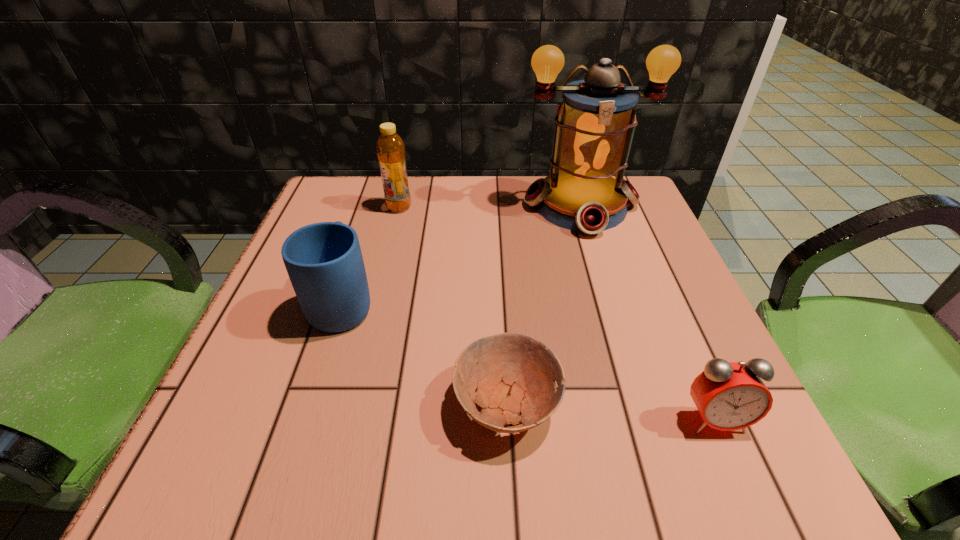
Where is `free space between the shortest object and the fourth shortest object`? free space between the shortest object and the fourth shortest object is located at coordinates (452, 306).

Where is `empty space between the lantern and the alarm clock`? This screenshot has width=960, height=540. empty space between the lantern and the alarm clock is located at coordinates (647, 312).

You are a GUI agent. You are given a task and a screenshot of the screen. Output one action in this format:
    pyautogui.click(x=<x>, y=<y>)
    Task: Click on the unoccupied position between the fourth tallest object and the lantern
    
    Given the screenshot: What is the action you would take?
    pyautogui.click(x=647, y=312)

Find the location of `vacant area that lies between the bowl and the bottle`. vacant area that lies between the bowl and the bottle is located at coordinates (452, 306).

Find the location of a particular element. This screenshot has width=960, height=540. free spot between the second tallest object and the alarm clock is located at coordinates point(557,313).

The height and width of the screenshot is (540, 960). Find the location of `free spot between the shortest object and the lantern`. free spot between the shortest object and the lantern is located at coordinates (543, 305).

Locate an element on the screen. the second closest object to the bowl is located at coordinates (729, 396).

Find the location of a particular element. Image resolution: width=960 pixels, height=540 pixels. object that is the second closest to the lantern is located at coordinates (324, 261).